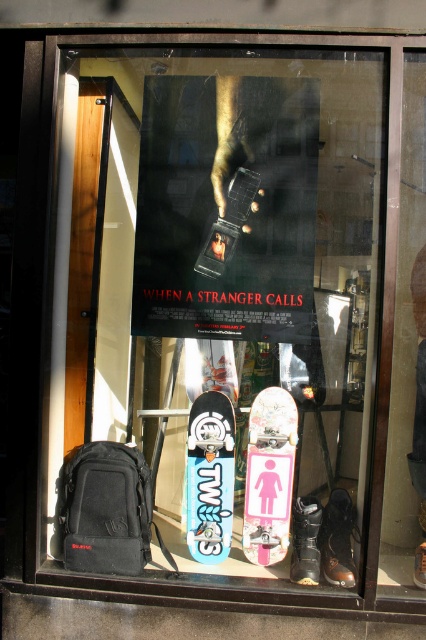
Describe the element at coordinates (227, 208) in the screenshot. I see `dark matte poster at center` at that location.

Where is `dark matte poster at center`? This screenshot has width=426, height=640. dark matte poster at center is located at coordinates (227, 208).

Can you confirm if pink glossy skateboard at center is wider than blue matte skateboard at center?

Yes.

Is the position of pink glossy skateboard at center more distant than that of blue matte skateboard at center?

No, it is in front of blue matte skateboard at center.

Is point (275, 536) positioned behind point (227, 520)?

No, (275, 536) is in front of (227, 520).

The height and width of the screenshot is (640, 426). Find the location of `pink glossy skateboard at center`. pink glossy skateboard at center is located at coordinates (268, 476).

Locate an element on the screen. Image resolution: width=426 pixels, height=640 pixels. dark matte poster at center is located at coordinates (227, 208).

Find the location of a particular element. Image resolution: width=426 pixels, height=640 pixels. dark matte poster at center is located at coordinates (227, 208).

This screenshot has width=426, height=640. Find the location of `dark matte poster at center`. dark matte poster at center is located at coordinates (227, 208).